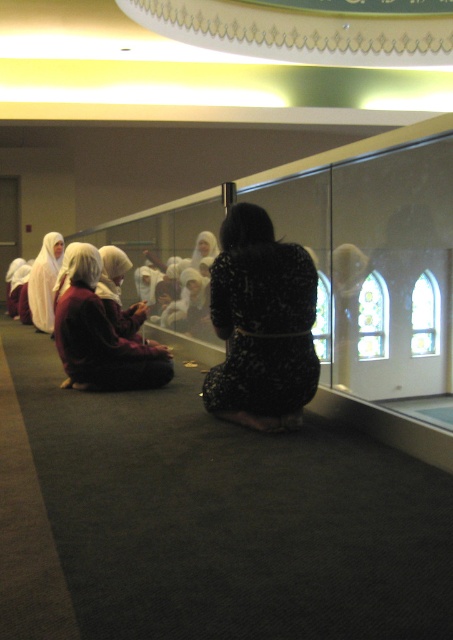
You are a photographer trying to capture the reflection of the dark brown fabric hijab at lower left and the white matte hijab at left in the glass wall. Which hijab will appear shorter in the reflection?

The dark brown fabric hijab at lower left is shorter than the white matte hijab at left, so in the reflection, the dark brown fabric hijab at lower left will also appear shorter.

From the picture: You are standing in the prayer hall and want to locate the black textured dress at center. According to the coordinates provided, where should you look?

The black textured dress at center is located at coordinates point (261, 324).